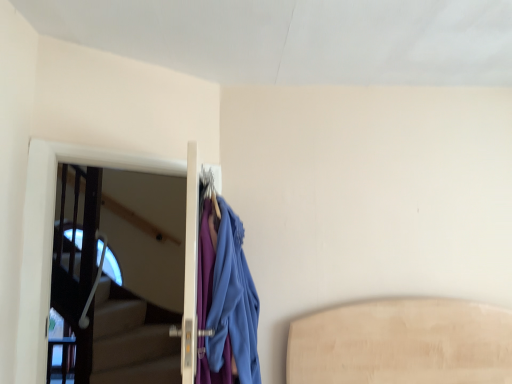
Question: From a real-world perspective, does blue fabric coat at center sit lower than transparent glass screen door at left?

Choices:
 (A) yes
 (B) no

Answer: (A)

Question: Considering the relative sizes of blue fabric coat at center and transparent glass screen door at left in the image provided, is blue fabric coat at center shorter than transparent glass screen door at left?

Choices:
 (A) no
 (B) yes

Answer: (B)

Question: Does blue fabric coat at center lie in front of transparent glass screen door at left?

Choices:
 (A) yes
 (B) no

Answer: (A)

Question: Are blue fabric coat at center and transparent glass screen door at left making contact?

Choices:
 (A) yes
 (B) no

Answer: (B)

Question: Does blue fabric coat at center have a greater height compared to transparent glass screen door at left?

Choices:
 (A) no
 (B) yes

Answer: (A)

Question: Can you confirm if blue fabric coat at center is thinner than transparent glass screen door at left?

Choices:
 (A) no
 (B) yes

Answer: (A)

Question: From a real-world perspective, is transparent glass screen door at left over blue fabric coat at center?

Choices:
 (A) no
 (B) yes

Answer: (B)

Question: Considering the relative sizes of transparent glass screen door at left and blue fabric coat at center in the image provided, is transparent glass screen door at left shorter than blue fabric coat at center?

Choices:
 (A) yes
 (B) no

Answer: (B)

Question: Is transparent glass screen door at left positioned far away from blue fabric coat at center?

Choices:
 (A) no
 (B) yes

Answer: (A)

Question: Does transparent glass screen door at left appear on the left side of blue fabric coat at center?

Choices:
 (A) no
 (B) yes

Answer: (B)

Question: Is transparent glass screen door at left looking in the opposite direction of blue fabric coat at center?

Choices:
 (A) yes
 (B) no

Answer: (B)

Question: Does transparent glass screen door at left come in front of blue fabric coat at center?

Choices:
 (A) no
 (B) yes

Answer: (A)

Question: Is blue fabric coat at center inside or outside of transparent glass screen door at left?

Choices:
 (A) inside
 (B) outside

Answer: (B)